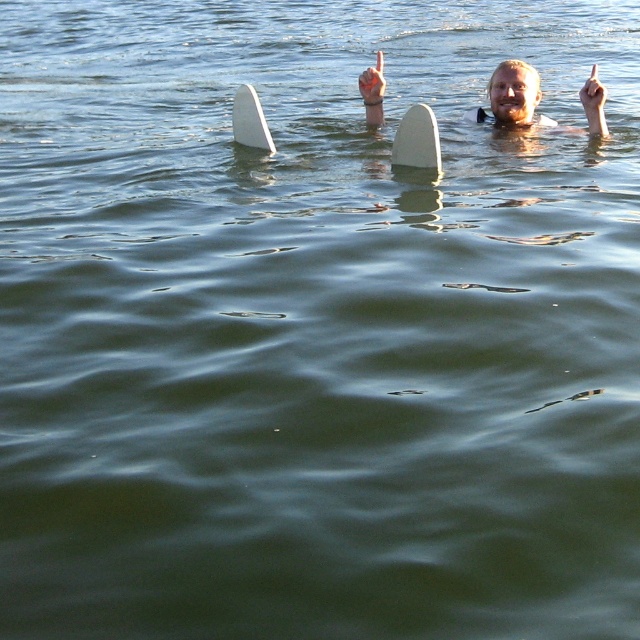
You are a photographer trying to capture the perfect shot of the person and the objects in the water. Based on the scene, can you determine if the white foam surfboard at center is above or below the white matte hand at upper center?

The white foam surfboard at center is located below the white matte hand at upper center, so the surfboard is positioned beneath the hand in the image.

You are a photographer trying to capture the perfect shot of the two points in the water. Which point, point (376,120) or point (381,74), will appear closer to the camera lens in your photo?

Point (381,74) will appear closer to the camera lens in the photo because it is closer to the viewer than point (376,120).